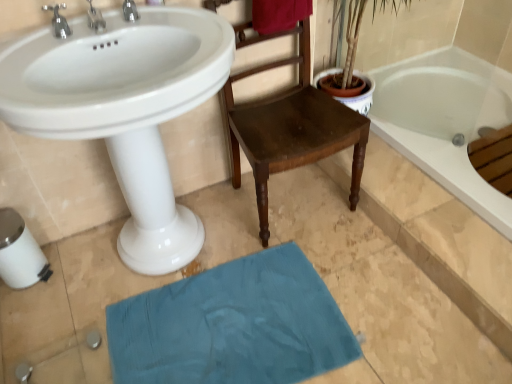
This screenshot has height=384, width=512. What are the coordinates of `vacant area that is in front of silver metallic faucet at upper left, positioned as the 3th tap in right-to-left order` in the screenshot? It's located at (36, 56).